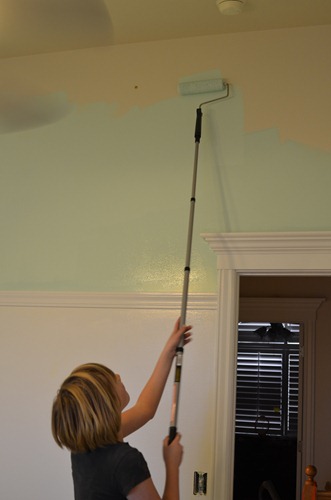
Image resolution: width=331 pixels, height=500 pixels. Identify the location of white wall. (131, 345).